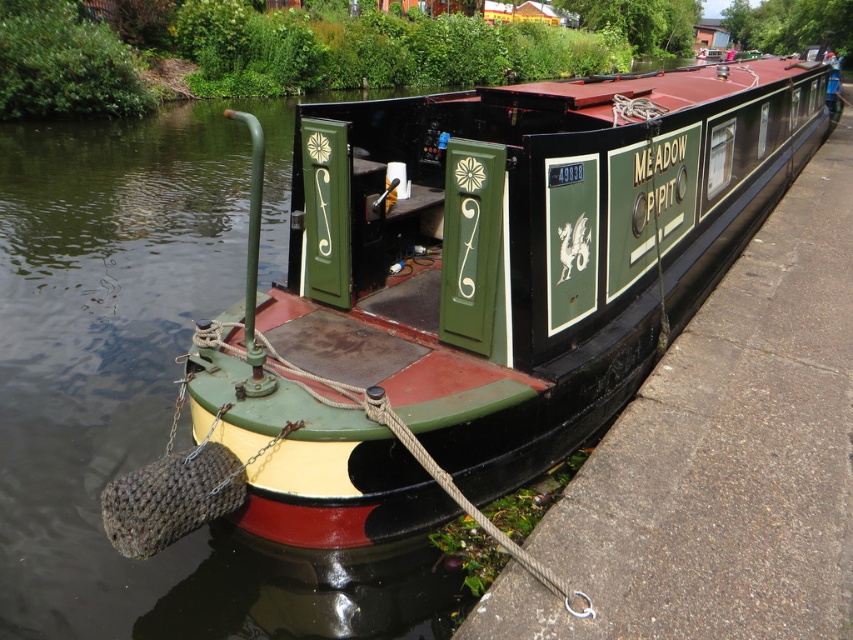
Question: Which of the following is the closest to the observer?

Choices:
 (A) (479, 284)
 (B) (756, 499)

Answer: (B)

Question: Which point is farther to the camera?

Choices:
 (A) (537, 392)
 (B) (799, 467)

Answer: (A)

Question: From the image, what is the correct spatial relationship of green polished wood boat at center in relation to green painted wood narrowboat at center?

Choices:
 (A) right
 (B) left

Answer: (A)

Question: Can you confirm if green polished wood boat at center is thinner than green painted wood narrowboat at center?

Choices:
 (A) yes
 (B) no

Answer: (B)

Question: Which point is farther to the camera?

Choices:
 (A) green polished wood boat at center
 (B) green painted wood narrowboat at center

Answer: (A)

Question: In this image, where is green polished wood boat at center located relative to green painted wood narrowboat at center?

Choices:
 (A) above
 (B) below

Answer: (A)